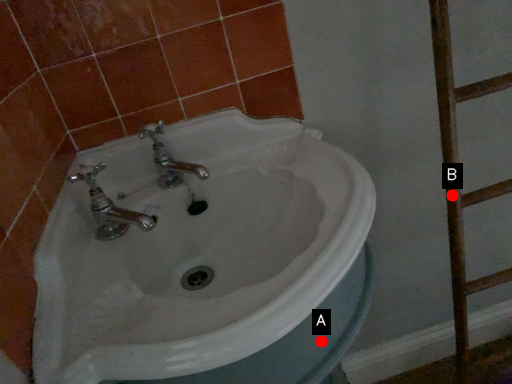
Question: Two points are circled on the image, labeled by A and B beside each circle. Which point appears closest to the camera in this image?

Choices:
 (A) A is closer
 (B) B is closer

Answer: (A)